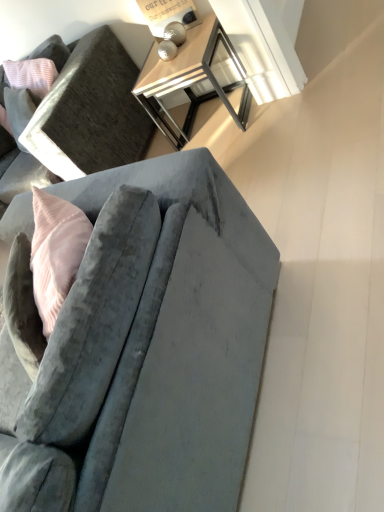
Measure the distance between point (207, 21) and camera.

The distance of point (207, 21) from camera is 6.87 feet.

Describe the element at coordinates (169, 17) in the screenshot. I see `metallic silver table lamp at upper center` at that location.

The image size is (384, 512). In order to click on metallic silver table lamp at upper center in this screenshot , I will do `click(169, 17)`.

Where is `metallic silver table at upper center`? metallic silver table at upper center is located at coordinates (190, 79).

Would you say velvet gray couch at lower left, the 2th studio couch in the bottom-to-top sequence, is inside or outside metallic silver table lamp at upper center?

velvet gray couch at lower left, the 2th studio couch in the bottom-to-top sequence, is outside metallic silver table lamp at upper center.

Between velvet gray couch at lower left, arranged as the 1th studio couch when viewed from the back, and metallic silver table lamp at upper center, which one appears on the right side from the viewer's perspective?

Positioned to the right is metallic silver table lamp at upper center.

From a real-world perspective, which object stands above the other?

From a 3D spatial view, metallic silver table lamp at upper center is above.

Considering the sizes of objects velvet gray couch at lower left, the 2th studio couch in the bottom-to-top sequence, and metallic silver table lamp at upper center in the image provided, who is shorter, velvet gray couch at lower left, the 2th studio couch in the bottom-to-top sequence, or metallic silver table lamp at upper center?

metallic silver table lamp at upper center.

Is metallic silver table lamp at upper center positioned in front of velvet gray couch at lower left, arranged as the 1th studio couch when viewed from the back?

No, metallic silver table lamp at upper center is behind velvet gray couch at lower left, arranged as the 1th studio couch when viewed from the back.

Considering the relative sizes of metallic silver table lamp at upper center and velvet gray couch at lower left, which is counted as the 2th studio couch, starting from the front, in the image provided, is metallic silver table lamp at upper center shorter than velvet gray couch at lower left, which is counted as the 2th studio couch, starting from the front,?

Indeed, metallic silver table lamp at upper center has a lesser height compared to velvet gray couch at lower left, which is counted as the 2th studio couch, starting from the front.

Locate an element on the screen. The image size is (384, 512). table lamp that is on the right side of velvet gray couch at lower left, arranged as the 1th studio couch when viewed from the back is located at coordinates (169, 17).

Could you tell me if metallic silver table lamp at upper center is facing velvet gray couch at lower left, arranged as the 1th studio couch when viewed from the top?

No, metallic silver table lamp at upper center is not aimed at velvet gray couch at lower left, arranged as the 1th studio couch when viewed from the top.

From a real-world perspective, does metallic silver table at upper center stand above velvet gray couch at center, the second studio couch in the back-to-front sequence?

No, from a real-world perspective, metallic silver table at upper center is not on top of velvet gray couch at center, the second studio couch in the back-to-front sequence.

Consider the image. Considering the sizes of objects metallic silver table at upper center and velvet gray couch at center, the second studio couch viewed from the top, in the image provided, who is taller, metallic silver table at upper center or velvet gray couch at center, the second studio couch viewed from the top,?

With more height is velvet gray couch at center, the second studio couch viewed from the top.

Which object is closer to the camera taking this photo, metallic silver table at upper center or velvet gray couch at center, the first studio couch when ordered from front to back?

velvet gray couch at center, the first studio couch when ordered from front to back, is in front.

In the scene shown: Is metallic silver table at upper center to the left of velvet gray couch at center, the second studio couch in the back-to-front sequence, from the viewer's perspective?

No, metallic silver table at upper center is not to the left of velvet gray couch at center, the second studio couch in the back-to-front sequence.

Is metallic silver table lamp at upper center directly adjacent to velvet gray couch at center, the second studio couch viewed from the top?

metallic silver table lamp at upper center and velvet gray couch at center, the second studio couch viewed from the top, are not in contact.

Is metallic silver table lamp at upper center not inside velvet gray couch at center, the second studio couch in the back-to-front sequence?

Yes, metallic silver table lamp at upper center is not within velvet gray couch at center, the second studio couch in the back-to-front sequence.

Does metallic silver table lamp at upper center have a smaller size compared to velvet gray couch at center, the second studio couch in the back-to-front sequence?

Indeed, metallic silver table lamp at upper center has a smaller size compared to velvet gray couch at center, the second studio couch in the back-to-front sequence.

Who is shorter, metallic silver table lamp at upper center or velvet gray couch at center, the second studio couch viewed from the top?

Standing shorter between the two is metallic silver table lamp at upper center.

Are velvet gray couch at center, the 1th studio couch in the bottom-to-top sequence, and metallic silver table lamp at upper center beside each other?

velvet gray couch at center, the 1th studio couch in the bottom-to-top sequence, and metallic silver table lamp at upper center are not in contact.

Can you confirm if velvet gray couch at center, the 1th studio couch in the bottom-to-top sequence, is smaller than metallic silver table lamp at upper center?

Incorrect, velvet gray couch at center, the 1th studio couch in the bottom-to-top sequence, is not smaller in size than metallic silver table lamp at upper center.

From the image's perspective, is velvet gray couch at center, the first studio couch when ordered from front to back, over metallic silver table lamp at upper center?

No.

Could you tell me if velvet gray couch at center, the second studio couch viewed from the top, is facing metallic silver table lamp at upper center?

No, velvet gray couch at center, the second studio couch viewed from the top, does not turn towards metallic silver table lamp at upper center.

Which is more to the left, velvet gray couch at center, the 1th studio couch in the bottom-to-top sequence, or velvet gray couch at lower left, arranged as the 1th studio couch when viewed from the back?

From the viewer's perspective, velvet gray couch at lower left, arranged as the 1th studio couch when viewed from the back, appears more on the left side.

Is velvet gray couch at center, the first studio couch when ordered from front to back, behind velvet gray couch at lower left, arranged as the 1th studio couch when viewed from the top?

No, it is not.

In the scene shown: From the image's perspective, which one is positioned higher, velvet gray couch at center, the first studio couch when ordered from front to back, or velvet gray couch at lower left, arranged as the 1th studio couch when viewed from the top?

velvet gray couch at lower left, arranged as the 1th studio couch when viewed from the top, appears higher in the image.

Does point (240, 452) come farther from viewer compared to point (75, 89)?

No.

Considering their positions, is velvet gray couch at lower left, the 2th studio couch in the bottom-to-top sequence, located in front of or behind metallic silver table at upper center?

velvet gray couch at lower left, the 2th studio couch in the bottom-to-top sequence, is in front of metallic silver table at upper center.

Consider the image. Looking at their sizes, would you say velvet gray couch at lower left, which is counted as the 2th studio couch, starting from the front, is wider or thinner than metallic silver table at upper center?

Considering their sizes, velvet gray couch at lower left, which is counted as the 2th studio couch, starting from the front, looks broader than metallic silver table at upper center.

How different are the orientations of velvet gray couch at lower left, which is counted as the 2th studio couch, starting from the front, and metallic silver table at upper center in degrees?

The facing directions of velvet gray couch at lower left, which is counted as the 2th studio couch, starting from the front, and metallic silver table at upper center are 2.33 degrees apart.

Is velvet gray couch at lower left, which is counted as the 2th studio couch, starting from the front, far away from metallic silver table at upper center?

That's not correct — velvet gray couch at lower left, which is counted as the 2th studio couch, starting from the front, is a little close to metallic silver table at upper center.

Image resolution: width=384 pixels, height=512 pixels. Find the location of `the 1st studio couch below the metallic silver table lamp at upper center (from the image's perspective)`. the 1st studio couch below the metallic silver table lamp at upper center (from the image's perspective) is located at coordinates (93, 108).

Find the location of a particular element. Image resolution: width=384 pixels, height=512 pixels. table lamp on the right of velvet gray couch at lower left, the 2th studio couch in the bottom-to-top sequence is located at coordinates (169, 17).

Estimate the real-world distances between objects in this image. Which object is closer to velvet gray couch at lower left, the 2th studio couch in the bottom-to-top sequence, metallic silver table lamp at upper center or velvet gray couch at center, the second studio couch viewed from the top?

The object closer to velvet gray couch at lower left, the 2th studio couch in the bottom-to-top sequence, is metallic silver table lamp at upper center.

When comparing their distances from metallic silver table at upper center, does metallic silver table lamp at upper center or velvet gray couch at center, the first studio couch when ordered from front to back, seem closer?

metallic silver table lamp at upper center.

When comparing their distances from velvet gray couch at lower left, which is counted as the 2th studio couch, starting from the front, does metallic silver table at upper center or metallic silver table lamp at upper center seem further?

The object further to velvet gray couch at lower left, which is counted as the 2th studio couch, starting from the front, is metallic silver table lamp at upper center.

From the image, which object appears to be farther from metallic silver table at upper center, velvet gray couch at center, the second studio couch in the back-to-front sequence, or velvet gray couch at lower left, the 2th studio couch in the bottom-to-top sequence?

velvet gray couch at center, the second studio couch in the back-to-front sequence, is further to metallic silver table at upper center.

From the image, which object appears to be farther from metallic silver table lamp at upper center, velvet gray couch at lower left, which is counted as the 2th studio couch, starting from the front, or metallic silver table at upper center?

The object further to metallic silver table lamp at upper center is velvet gray couch at lower left, which is counted as the 2th studio couch, starting from the front.

When comparing their distances from metallic silver table at upper center, does velvet gray couch at lower left, which is counted as the 2th studio couch, starting from the front, or velvet gray couch at center, the first studio couch when ordered from front to back, seem closer?

Based on the image, velvet gray couch at lower left, which is counted as the 2th studio couch, starting from the front, appears to be nearer to metallic silver table at upper center.

In the scene shown: Estimate the real-world distances between objects in this image. Which object is closer to velvet gray couch at lower left, arranged as the 1th studio couch when viewed from the back, metallic silver table lamp at upper center or metallic silver table at upper center?

metallic silver table at upper center is positioned closer to the anchor velvet gray couch at lower left, arranged as the 1th studio couch when viewed from the back.

Which object lies nearer to the anchor point metallic silver table at upper center, metallic silver table lamp at upper center or velvet gray couch at lower left, which is counted as the 2th studio couch, starting from the front?

metallic silver table lamp at upper center lies closer to metallic silver table at upper center than the other object.

You are a GUI agent. You are given a task and a screenshot of the screen. Output one action in this format:
    pyautogui.click(x=<x>, y=<y>)
    Task: Click on the studio couch between metallic silver table lamp at upper center and velvet gray couch at center, the second studio couch in the back-to-front sequence, vertically
    This screenshot has width=384, height=512.
    Given the screenshot: What is the action you would take?
    pyautogui.click(x=93, y=108)

The image size is (384, 512). Find the location of `table between metallic silver table lamp at upper center and velvet gray couch at center, the 1th studio couch in the bottom-to-top sequence, in the vertical direction`. table between metallic silver table lamp at upper center and velvet gray couch at center, the 1th studio couch in the bottom-to-top sequence, in the vertical direction is located at coordinates (190, 79).

You are a GUI agent. You are given a task and a screenshot of the screen. Output one action in this format:
    pyautogui.click(x=<x>, y=<y>)
    Task: Click on the studio couch positioned between velvet gray couch at center, the second studio couch in the back-to-front sequence, and metallic silver table at upper center from near to far
    The image size is (384, 512).
    Given the screenshot: What is the action you would take?
    pyautogui.click(x=93, y=108)

At what (x,y) coordinates should I click in order to perform the action: click on table lamp between velvet gray couch at lower left, arranged as the 1th studio couch when viewed from the top, and metallic silver table at upper center. Please return your answer as a coordinate pair (x, y). The image size is (384, 512). Looking at the image, I should click on (169, 17).